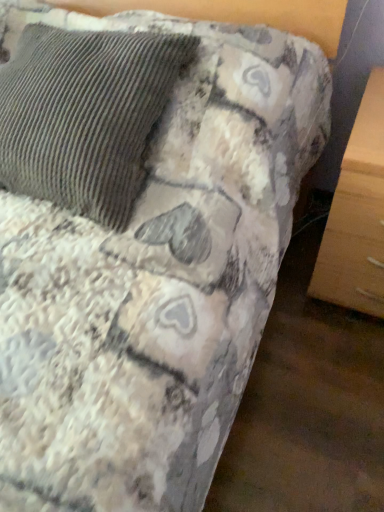
Measure the distance between light wood drawer at lower right and camera.

light wood drawer at lower right and camera are 96.77 centimeters apart.

Find the location of a particular element. light wood drawer at lower right is located at coordinates (353, 246).

Image resolution: width=384 pixels, height=512 pixels. What do you see at coordinates (353, 246) in the screenshot?
I see `light wood drawer at lower right` at bounding box center [353, 246].

What do you see at coordinates (85, 115) in the screenshot? Image resolution: width=384 pixels, height=512 pixels. I see `textured corduroy pillow at upper left` at bounding box center [85, 115].

This screenshot has height=512, width=384. I want to click on textured corduroy pillow at upper left, so click(85, 115).

Locate an element on the screen. light wood drawer at lower right is located at coordinates (353, 246).

Is light wood drawer at lower right at the right side of textured corduroy pillow at upper left?

Correct, you'll find light wood drawer at lower right to the right of textured corduroy pillow at upper left.

Is light wood drawer at lower right positioned behind textured corduroy pillow at upper left?

Yes, light wood drawer at lower right is further from the camera.

Is point (365, 248) positioned behind point (105, 106)?

Yes, it is behind point (105, 106).

From the image's perspective, between light wood drawer at lower right and textured corduroy pillow at upper left, who is located below?

light wood drawer at lower right, from the image's perspective.

From a real-world perspective, is light wood drawer at lower right below textured corduroy pillow at upper left?

Yes, from a real-world perspective, light wood drawer at lower right is below textured corduroy pillow at upper left.

Is light wood drawer at lower right wider or thinner than textured corduroy pillow at upper left?

Considering their sizes, light wood drawer at lower right looks broader than textured corduroy pillow at upper left.

Can you confirm if light wood drawer at lower right is taller than textured corduroy pillow at upper left?

No.

Considering the relative sizes of light wood drawer at lower right and textured corduroy pillow at upper left in the image provided, is light wood drawer at lower right bigger than textured corduroy pillow at upper left?

No.

Do you think light wood drawer at lower right is within textured corduroy pillow at upper left, or outside of it?

light wood drawer at lower right is not inside textured corduroy pillow at upper left, it's outside.

Is light wood drawer at lower right next to textured corduroy pillow at upper left and touching it?

No, light wood drawer at lower right is not in contact with textured corduroy pillow at upper left.

Does light wood drawer at lower right turn towards textured corduroy pillow at upper left?

No, light wood drawer at lower right does not turn towards textured corduroy pillow at upper left.

What's the angular difference between light wood drawer at lower right and textured corduroy pillow at upper left's facing directions?

The angle between the facing direction of light wood drawer at lower right and the facing direction of textured corduroy pillow at upper left is 0.711 degrees.

You are a GUI agent. You are given a task and a screenshot of the screen. Output one action in this format:
    pyautogui.click(x=<x>, y=<y>)
    Task: Click on the drawer below the textured corduroy pillow at upper left (from a real-world perspective)
    
    Given the screenshot: What is the action you would take?
    pyautogui.click(x=353, y=246)

Based on their positions, is textured corduroy pillow at upper left located to the left or right of light wood drawer at lower right?

textured corduroy pillow at upper left is to the left of light wood drawer at lower right.

Considering their positions, is textured corduroy pillow at upper left located in front of or behind light wood drawer at lower right?

Visually, textured corduroy pillow at upper left is located in front of light wood drawer at lower right.

Is point (77, 57) less distant than point (370, 185)?

Yes.

From the image's perspective, would you say textured corduroy pillow at upper left is shown under light wood drawer at lower right?

No, from the image's perspective, textured corduroy pillow at upper left is not below light wood drawer at lower right.

From a real-world perspective, which object stands above the other?

textured corduroy pillow at upper left, from a real-world perspective.

Does textured corduroy pillow at upper left have a greater width compared to light wood drawer at lower right?

No.

Can you confirm if textured corduroy pillow at upper left is shorter than light wood drawer at lower right?

Incorrect, the height of textured corduroy pillow at upper left does not fall short of that of light wood drawer at lower right.

Between textured corduroy pillow at upper left and light wood drawer at lower right, which one has larger size?

Result: Bigger between the two is textured corduroy pillow at upper left.

Is light wood drawer at lower right completely or partially inside textured corduroy pillow at upper left?

No, textured corduroy pillow at upper left does not contain light wood drawer at lower right.

Are textured corduroy pillow at upper left and light wood drawer at lower right beside each other?

No, textured corduroy pillow at upper left is not beside light wood drawer at lower right.

Based on the photo, is textured corduroy pillow at upper left facing towards light wood drawer at lower right?

No, textured corduroy pillow at upper left is not oriented towards light wood drawer at lower right.

How many degrees apart are the facing directions of textured corduroy pillow at upper left and light wood drawer at lower right?

0.711 degrees separate the facing orientations of textured corduroy pillow at upper left and light wood drawer at lower right.

Identify the location of drawer to the right of textured corduroy pillow at upper left. Image resolution: width=384 pixels, height=512 pixels. click(353, 246).

The image size is (384, 512). What are the coordinates of `pillow that is in front of the light wood drawer at lower right` in the screenshot? It's located at (85, 115).

Where is `drawer on the right of the textured corduroy pillow at upper left`? This screenshot has width=384, height=512. drawer on the right of the textured corduroy pillow at upper left is located at coordinates click(353, 246).